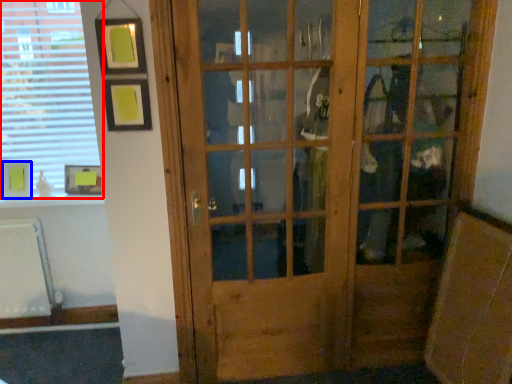
Question: Which object appears closest to the camera in this image, window (highlighted by a red box) or picture frame (highlighted by a blue box)?

Choices:
 (A) window
 (B) picture frame

Answer: (A)